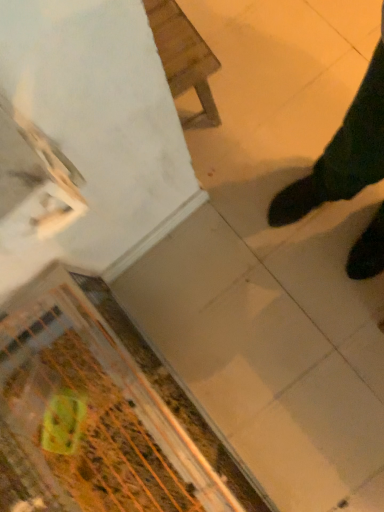
Question: Is green plastic bag at lower left positioned with its back to wooden chair at upper center?

Choices:
 (A) yes
 (B) no

Answer: (B)

Question: Are green plastic bag at lower left and wooden chair at upper center making contact?

Choices:
 (A) yes
 (B) no

Answer: (B)

Question: Is wooden chair at upper center a part of green plastic bag at lower left?

Choices:
 (A) no
 (B) yes

Answer: (A)

Question: Does green plastic bag at lower left have a larger size compared to wooden chair at upper center?

Choices:
 (A) yes
 (B) no

Answer: (B)

Question: Is green plastic bag at lower left far from wooden chair at upper center?

Choices:
 (A) no
 (B) yes

Answer: (A)

Question: Is green plastic bag at lower left located outside wooden chair at upper center?

Choices:
 (A) no
 (B) yes

Answer: (B)

Question: Is wooden chair at upper center to the left of green plastic bag at lower left from the viewer's perspective?

Choices:
 (A) no
 (B) yes

Answer: (A)

Question: Is the depth of wooden chair at upper center less than that of green plastic bag at lower left?

Choices:
 (A) yes
 (B) no

Answer: (B)

Question: Does wooden chair at upper center have a lesser height compared to green plastic bag at lower left?

Choices:
 (A) no
 (B) yes

Answer: (A)

Question: Does wooden chair at upper center have a lesser width compared to green plastic bag at lower left?

Choices:
 (A) no
 (B) yes

Answer: (B)

Question: Could you tell me if wooden chair at upper center is facing green plastic bag at lower left?

Choices:
 (A) yes
 (B) no

Answer: (B)

Question: Can you confirm if wooden chair at upper center is smaller than green plastic bag at lower left?

Choices:
 (A) no
 (B) yes

Answer: (A)

Question: Which is correct: wooden chair at upper center is inside green plastic bag at lower left, or outside of it?

Choices:
 (A) inside
 (B) outside

Answer: (B)